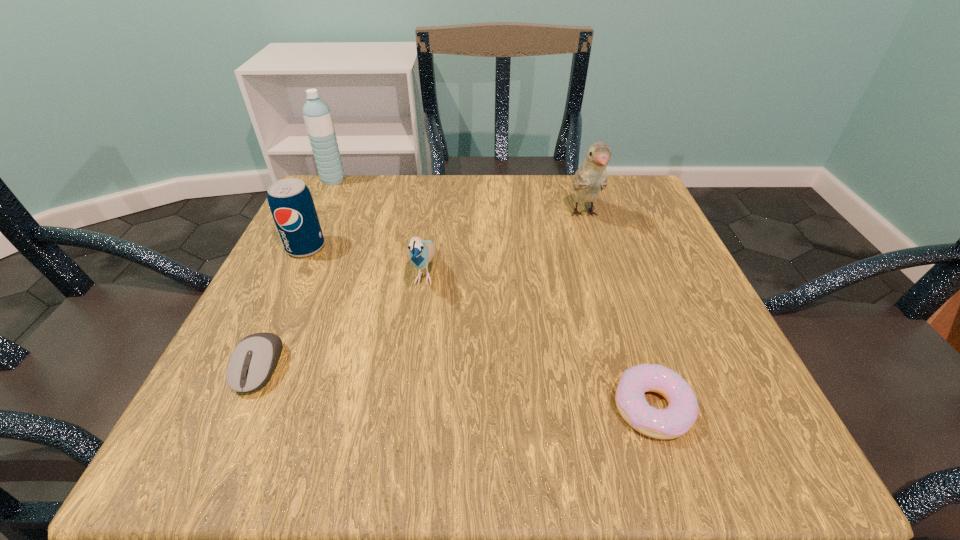
I want to click on vacant space positioned at the face of the farther bird, so click(620, 332).

The height and width of the screenshot is (540, 960). Identify the location of free spot located 0.090m on the front of the pop. (284, 292).

The image size is (960, 540). What are the coordinates of `vacant space situated at the face of the left bird` in the screenshot? It's located at (412, 361).

Identify the location of vacant space located on the left of the doughnut. (361, 408).

What are the coordinates of `free space located on the wheel side of the computer equipment` in the screenshot? It's located at (221, 452).

This screenshot has height=540, width=960. In order to click on water bottle situated at the far edge in this screenshot , I will do click(317, 115).

In order to click on bird located in the far edge section of the desktop in this screenshot , I will do `click(591, 177)`.

At what (x,y) coordinates should I click in order to perform the action: click on object located in the near edge section of the desktop. Please return your answer as a coordinate pair (x, y). Looking at the image, I should click on (675, 420).

Where is `water bottle situated at the left edge`? The width and height of the screenshot is (960, 540). water bottle situated at the left edge is located at coordinates (317, 115).

Locate an element on the screen. pop that is positioned at the left edge is located at coordinates (291, 204).